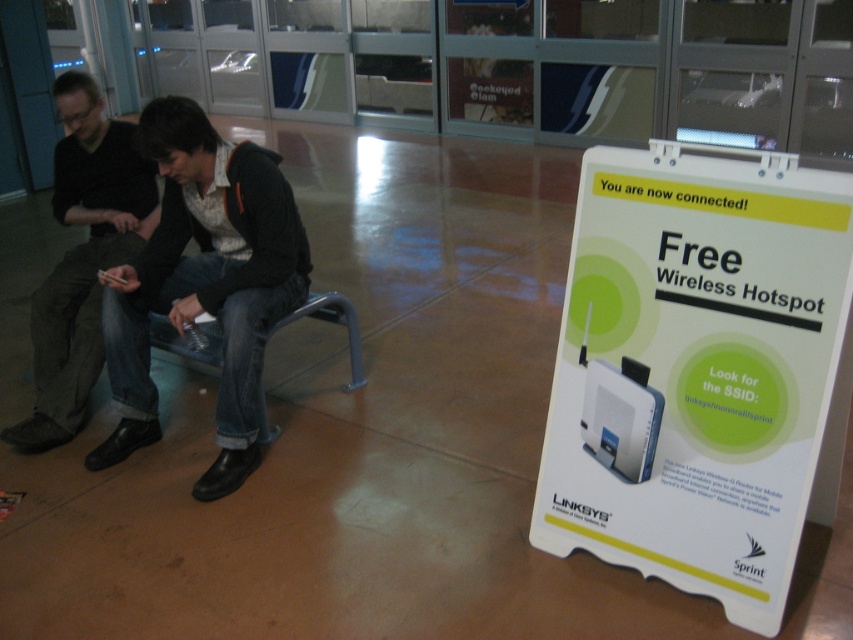
Question: Is jeans at left bigger than dark brown leather shoes at lower left?

Choices:
 (A) no
 (B) yes

Answer: (B)

Question: Does jeans at left have a larger size compared to dark brown leather shoes at lower left?

Choices:
 (A) yes
 (B) no

Answer: (A)

Question: Is jeans at left below dark brown leather shoes at lower left?

Choices:
 (A) yes
 (B) no

Answer: (A)